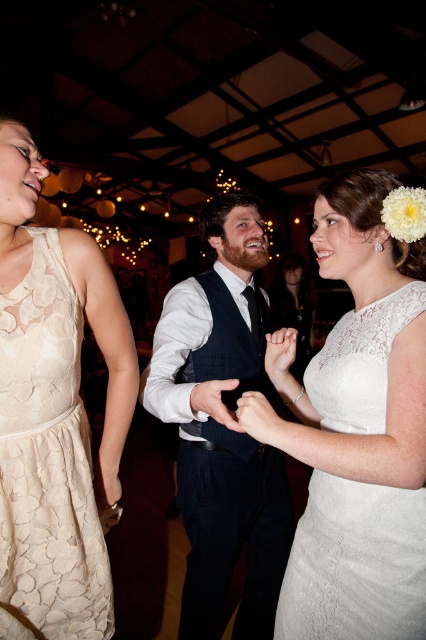
Question: Which of the following is the farthest from the observer?

Choices:
 (A) [x=57, y=404]
 (B) [x=305, y=518]
 (C) [x=287, y=310]
 (D) [x=270, y=454]

Answer: (C)

Question: Does lace fabric dress at left appear on the right side of white lace dress at center?

Choices:
 (A) no
 (B) yes

Answer: (A)

Question: Considering the real-world distances, which object is farthest from the dark blue textured vest at center?

Choices:
 (A) lace fabric dress at left
 (B) white lace dress at center

Answer: (B)

Question: Observing the image, what is the correct spatial positioning of lace fabric dress at left in reference to white lace dress at center?

Choices:
 (A) below
 (B) above

Answer: (A)

Question: Can you confirm if lace fabric dress at left is wider than lace white dress at center?

Choices:
 (A) no
 (B) yes

Answer: (A)

Question: Based on their relative distances, which object is nearer to the white lace dress at center?

Choices:
 (A) lace white dress at center
 (B) dark blue textured vest at center
 (C) lace fabric dress at left

Answer: (B)